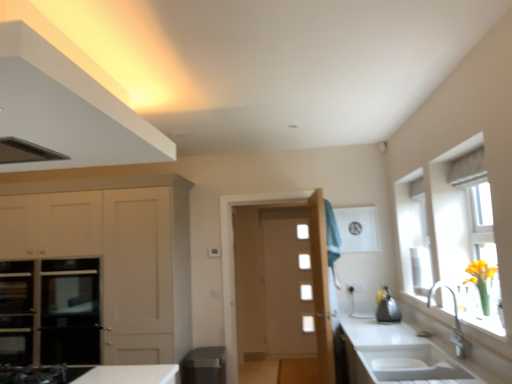
Question: Is matte white cabinet at upper left, placed as the 2th cabinetry when sorted from bottom to top, not close to white ceramic sink at lower right?

Choices:
 (A) no
 (B) yes

Answer: (B)

Question: From the image's perspective, does matte white cabinet at upper left, placed as the 2th cabinetry when sorted from bottom to top, appear higher than white ceramic sink at lower right?

Choices:
 (A) no
 (B) yes

Answer: (B)

Question: Considering the relative sizes of matte white cabinet at upper left, placed as the second cabinetry when sorted from back to front, and white ceramic sink at lower right in the image provided, is matte white cabinet at upper left, placed as the second cabinetry when sorted from back to front, thinner than white ceramic sink at lower right?

Choices:
 (A) yes
 (B) no

Answer: (B)

Question: Is matte white cabinet at upper left, placed as the second cabinetry when sorted from back to front, at the left side of white ceramic sink at lower right?

Choices:
 (A) no
 (B) yes

Answer: (B)

Question: Is matte white cabinet at upper left, placed as the second cabinetry when sorted from back to front, facing towards white ceramic sink at lower right?

Choices:
 (A) yes
 (B) no

Answer: (B)

Question: Does matte white cabinet at upper left, which is the 1th cabinetry from front to back, lie behind white ceramic sink at lower right?

Choices:
 (A) no
 (B) yes

Answer: (A)

Question: Is white glass door at center not near satin black kettle at right?

Choices:
 (A) yes
 (B) no

Answer: (A)

Question: Does white glass door at center appear on the left side of satin black kettle at right?

Choices:
 (A) yes
 (B) no

Answer: (A)

Question: From the image's perspective, is white glass door at center over satin black kettle at right?

Choices:
 (A) no
 (B) yes

Answer: (A)

Question: Can you confirm if white glass door at center is positioned to the right of satin black kettle at right?

Choices:
 (A) no
 (B) yes

Answer: (A)

Question: Does white glass door at center contain satin black kettle at right?

Choices:
 (A) yes
 (B) no

Answer: (B)

Question: From the image's perspective, would you say white glass door at center is shown under satin black kettle at right?

Choices:
 (A) yes
 (B) no

Answer: (A)

Question: Is translucent glass window at right touching satin black kettle at right?

Choices:
 (A) yes
 (B) no

Answer: (B)